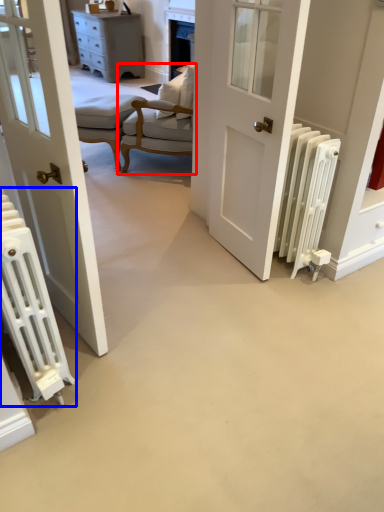
Question: Which object appears closest to the camera in this image, chair (highlighted by a red box) or radiator (highlighted by a blue box)?

Choices:
 (A) chair
 (B) radiator

Answer: (B)